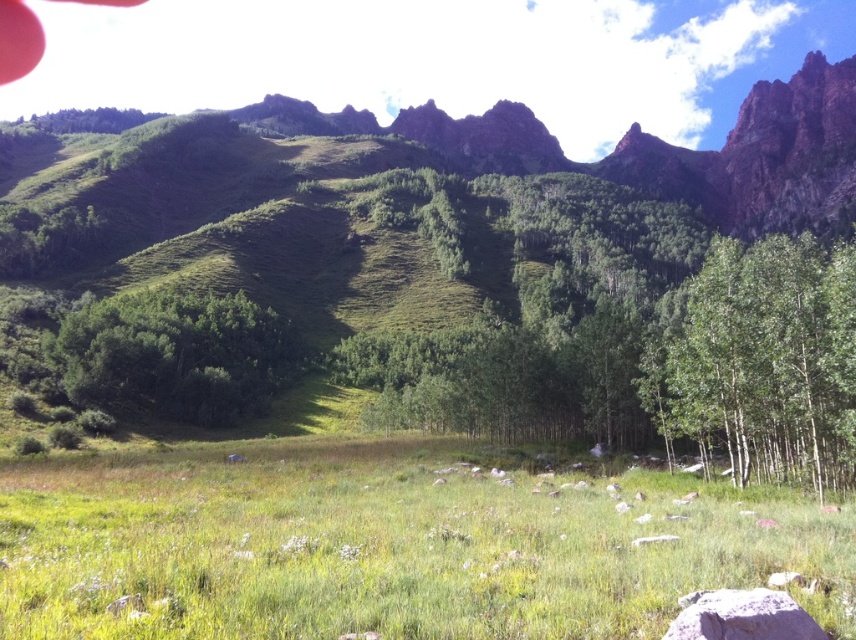
Question: Which point is closer to the camera?

Choices:
 (A) (189, 556)
 (B) (153, 396)
 (C) (819, 632)
 (D) (842, 442)

Answer: (C)

Question: Considering the real-world distances, which object is closest to the green leafy tree at center?

Choices:
 (A) green matte tree at lower right
 (B) gray rock at lower center
 (C) green grassy field at center

Answer: (C)

Question: Is green matte tree at lower right smaller than gray rock at lower center?

Choices:
 (A) no
 (B) yes

Answer: (A)

Question: Is green grassy field at center behind green matte tree at lower right?

Choices:
 (A) yes
 (B) no

Answer: (B)

Question: Can you confirm if green grassy field at center is positioned below green matte tree at lower right?

Choices:
 (A) no
 (B) yes

Answer: (B)

Question: Which is nearer to the green grassy field at center?

Choices:
 (A) gray rock at lower center
 (B) green leafy tree at center

Answer: (A)